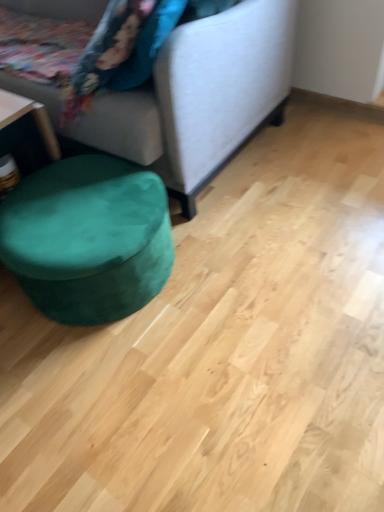
Where is `free space in front of velvet green ottoman at lower left`? free space in front of velvet green ottoman at lower left is located at coordinates (118, 392).